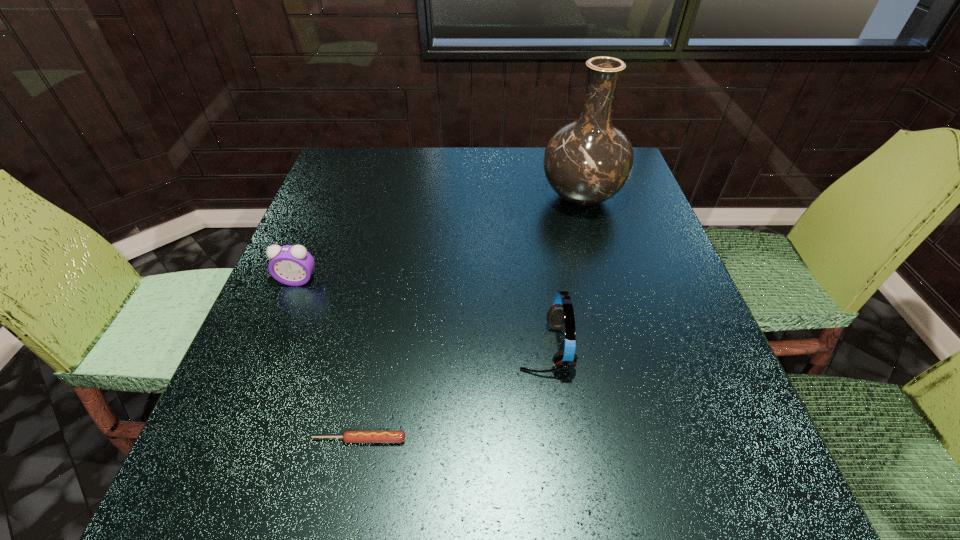
Find the location of a particular element. vacant area that lies between the third shortest object and the shortest object is located at coordinates (452, 393).

Image resolution: width=960 pixels, height=540 pixels. I want to click on empty space between the nearest object and the headset, so click(x=452, y=393).

Image resolution: width=960 pixels, height=540 pixels. In order to click on vacant space that is in between the vase and the second shortest object in this screenshot , I will do `click(440, 239)`.

This screenshot has height=540, width=960. I want to click on object identified as the third closest to the tallest object, so click(x=349, y=436).

Locate which object ranks in proximity to the nearest object. Please provide its 2D coordinates. Your answer should be formatted as a tuple, i.e. [(x, y)], where the tuple contains the x and y coordinates of a point satisfying the conditions above.

[(561, 314)]

Locate an element on the screen. This screenshot has width=960, height=540. free space that satisfies the following two spatial constraints: 1. on the face of the third tallest object; 2. on the right side of the sausage is located at coordinates (232, 440).

The image size is (960, 540). In order to click on free point that satisfies the following two spatial constraints: 1. on the face of the sausage; 2. on the right side of the second shortest object in this screenshot , I will do `click(232, 440)`.

This screenshot has height=540, width=960. In order to click on free space in the image that satisfies the following two spatial constraints: 1. with the microphone attached to the side of the headset; 2. on the front side of the sausage in this screenshot , I will do `click(556, 440)`.